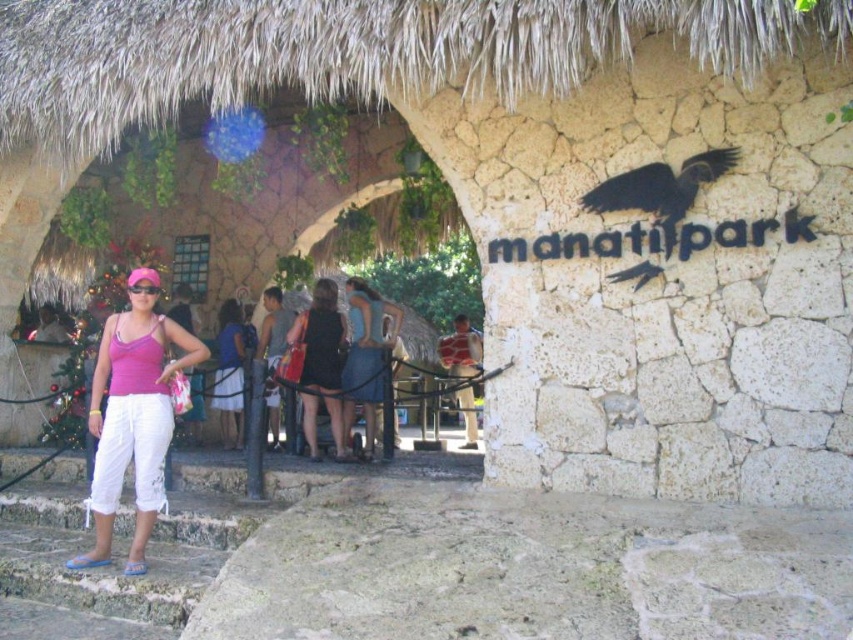
Can you confirm if blue denim skirt at center is positioned to the right of black plastic goggles at center?

Indeed, blue denim skirt at center is positioned on the right side of black plastic goggles at center.

Does blue denim skirt at center appear under black plastic goggles at center?

Indeed, blue denim skirt at center is positioned under black plastic goggles at center.

Which is behind, point (350, 333) or point (141, 291)?

The point (350, 333) is behind.

The height and width of the screenshot is (640, 853). Identify the location of blue denim skirt at center. (364, 355).

Is matte black dress at center behind black plastic goggles at center?

Yes, matte black dress at center is further from the viewer.

Is point (326, 369) farther from viewer compared to point (148, 282)?

Yes, point (326, 369) is farther from viewer.

The image size is (853, 640). Identify the location of matte black dress at center. (321, 364).

Looking at this image, between matte black dress at center and blue denim dress at center, which one has more height?

Standing taller between the two is matte black dress at center.

Is matte black dress at center smaller than blue denim dress at center?

Actually, matte black dress at center might be larger than blue denim dress at center.

Image resolution: width=853 pixels, height=640 pixels. Find the location of `matte black dress at center`. matte black dress at center is located at coordinates coord(321,364).